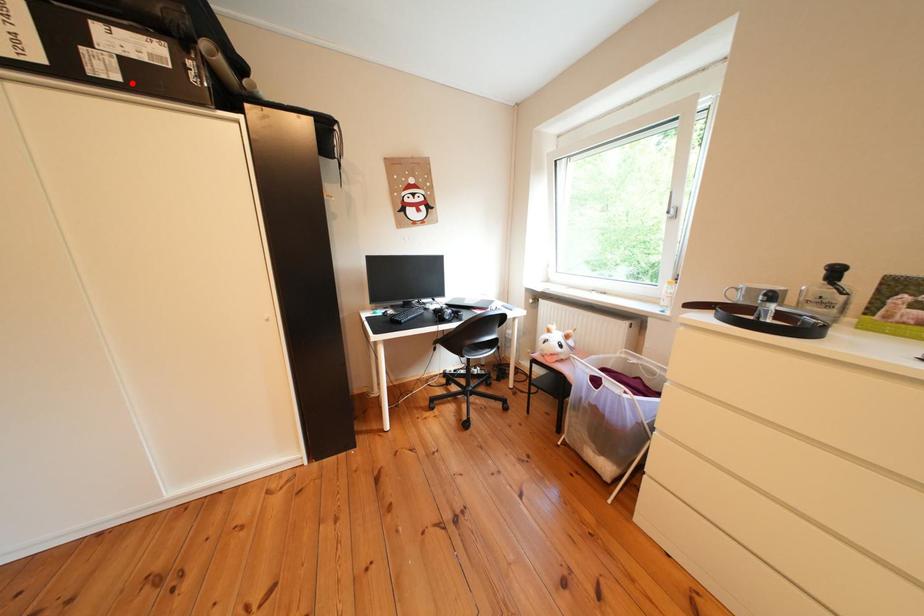
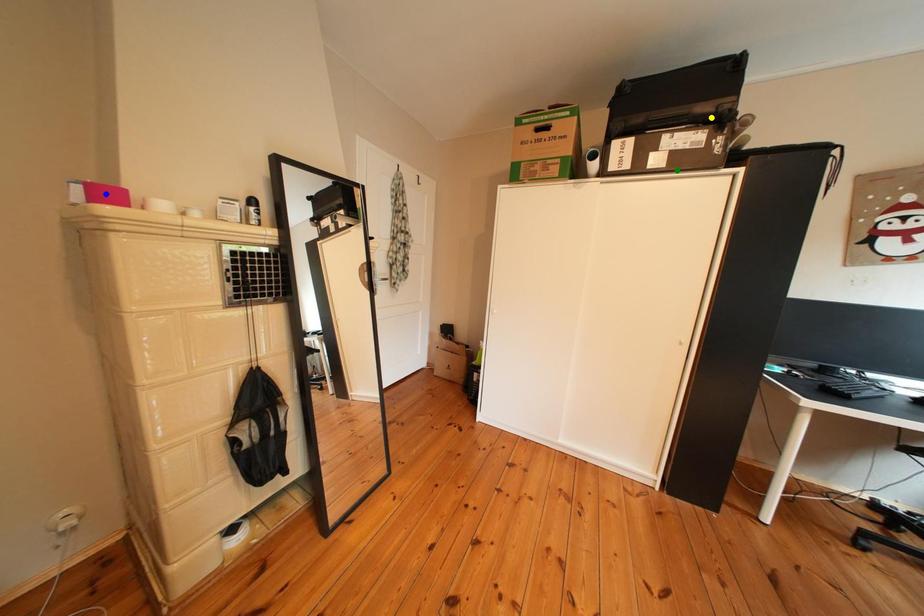
Question: I am providing you with two images of the same scene from different viewpoints. A red point is marked on the first image. You are given multiple points on the second image. Which point in image 2 is actually the same real-world point as the red point in image 1?

Choices:
 (A) green point
 (B) yellow point
 (C) blue point

Answer: (A)